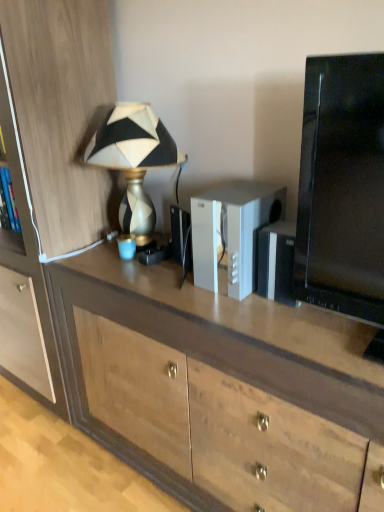
What are the coordinates of `vacant space in front of white plastic speaker at center` in the screenshot? It's located at (255, 320).